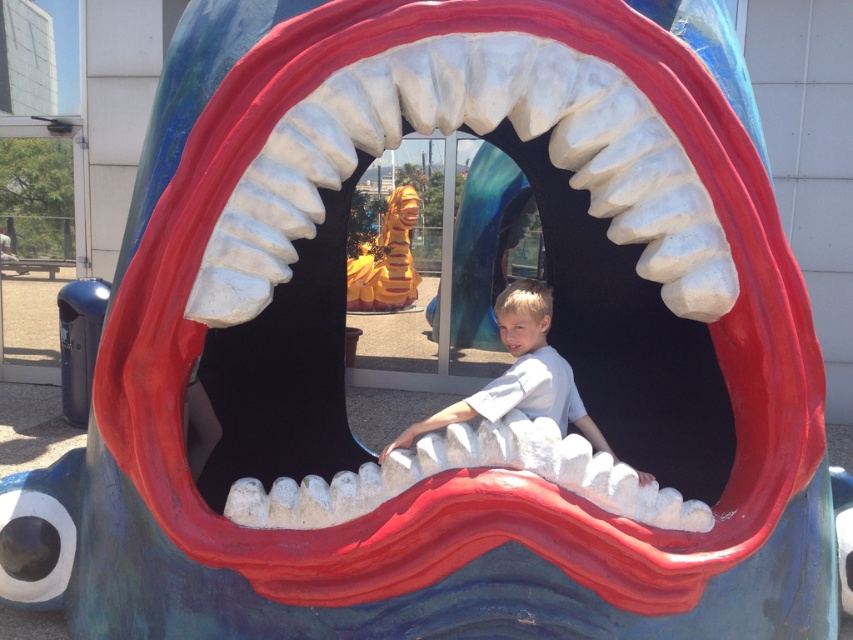
You are a photographer trying to capture the boy in the sculpture. The light blue cotton shirt at center and the white matte teeth at center are both in your viewfinder. Which object is closer to the camera?

→ The light blue cotton shirt at center is closer to the camera because it is in front of the white matte teeth at center.

You are a photographer trying to capture a photo of the gold metallic dragon at center and the white matte teeth at center. According to the scene, which object should you adjust your camera to focus on first if you want to capture both in the same frame?

The gold metallic dragon at center is to the left of white matte teeth at center, so you should focus on the gold metallic dragon at center first to ensure both are in frame.